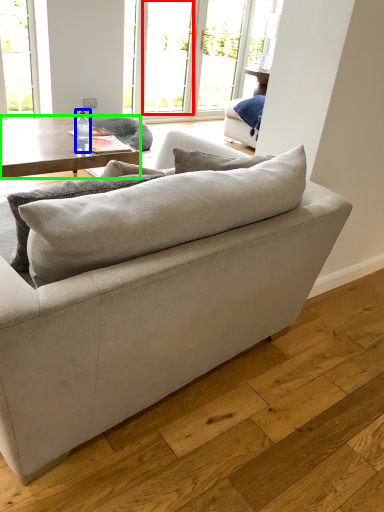
Question: Based on their relative distances, which object is farther from window (highlighted by a red box)? Choose from bottle (highlighted by a blue box) and coffee table (highlighted by a green box).

Choices:
 (A) bottle
 (B) coffee table

Answer: (A)